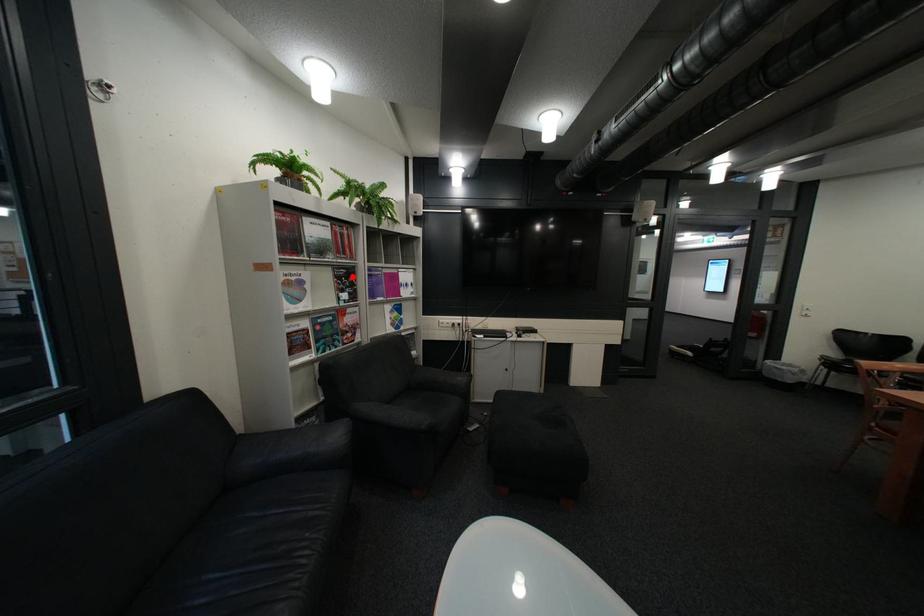
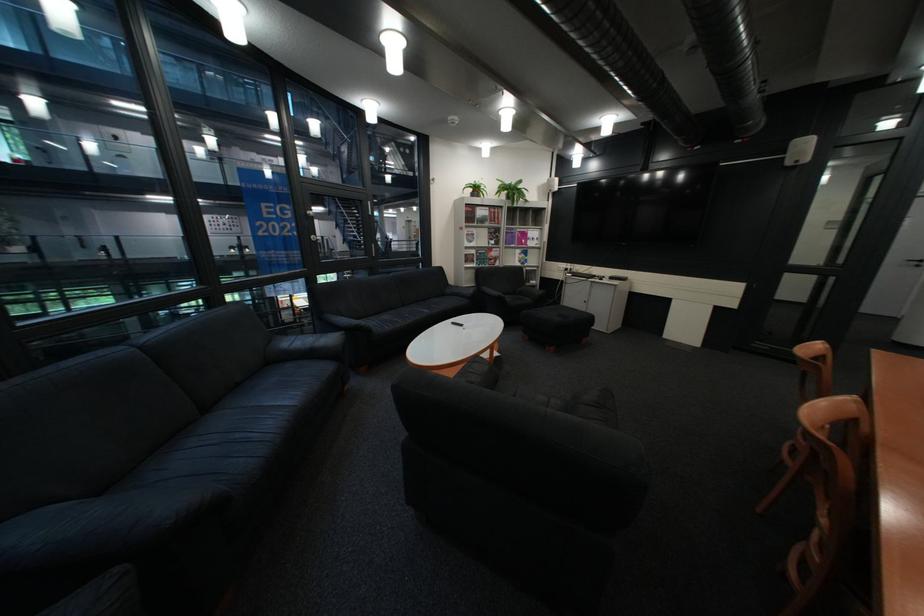
Where in the second image is the point corresponding to the highlighted location from the first image?

(505, 233)